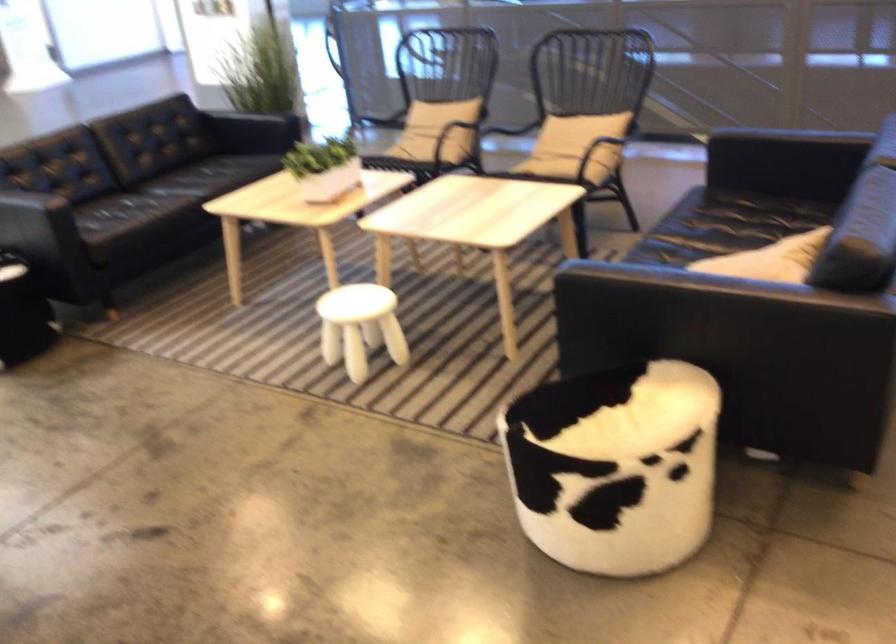
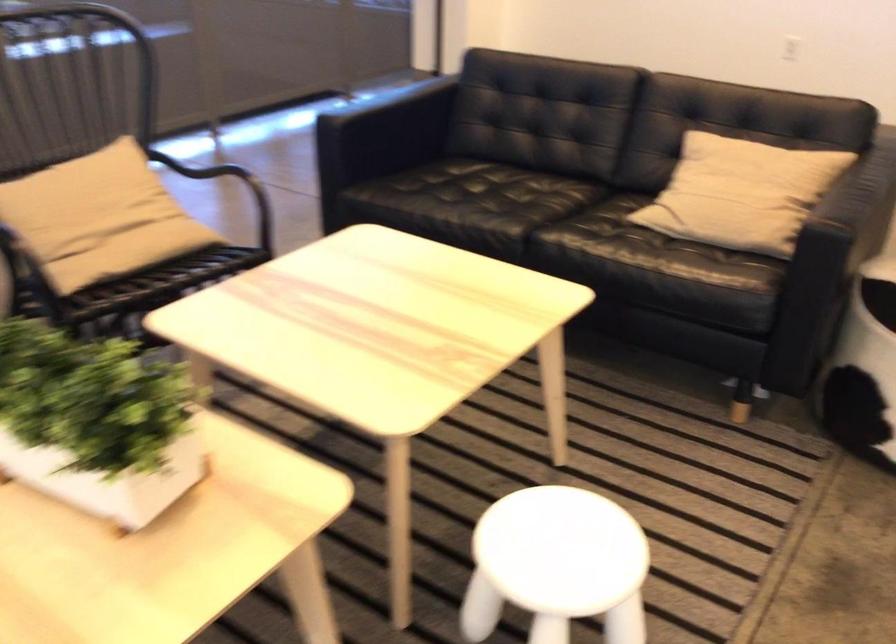
Question: I am providing you with two images of the same scene from different viewpoints. Please identify which objects are invisible in image2.

Choices:
 (A) beige pillow
 (B) chair sitting surface
 (C) black luggage
 (D) small white stool

Answer: (D)